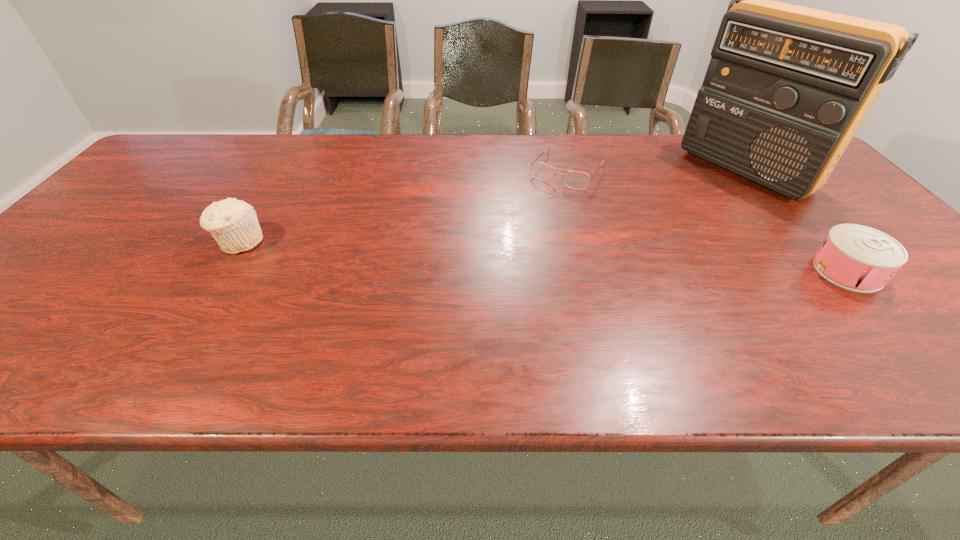
Where is `the leftmost object`? The image size is (960, 540). the leftmost object is located at coordinates (233, 223).

Locate an element on the screen. Image resolution: width=960 pixels, height=540 pixels. the third shortest object is located at coordinates (233, 223).

Find the location of a particular element. can is located at coordinates (855, 257).

I want to click on the third object from right to left, so click(576, 180).

This screenshot has width=960, height=540. Find the location of `the shortest object`. the shortest object is located at coordinates (576, 180).

What are the coordinates of `radio receiver` in the screenshot? It's located at (787, 87).

Where is `vacant space situated on the right of the muffin`? This screenshot has height=540, width=960. vacant space situated on the right of the muffin is located at coordinates (360, 242).

Find the location of `free spot located on the back of the second shortest object`. free spot located on the back of the second shortest object is located at coordinates tap(816, 234).

Where is `free spot located 0.380m on the front-facing side of the third object from right to left`? This screenshot has width=960, height=540. free spot located 0.380m on the front-facing side of the third object from right to left is located at coordinates (495, 273).

At what (x,y) coordinates should I click in order to perform the action: click on free space located on the front-facing side of the third object from right to left. Please return your answer as a coordinate pair (x, y). This screenshot has height=540, width=960. Looking at the image, I should click on (499, 267).